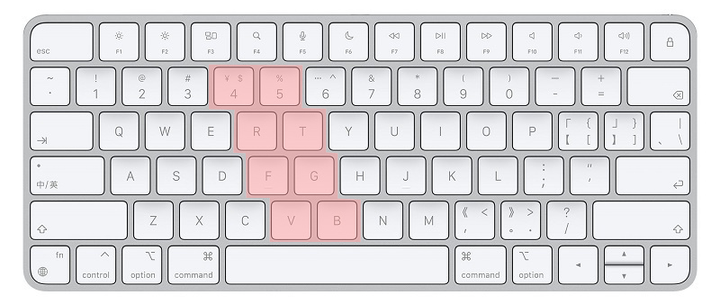
In order to click on square pink keys on keyboard in this screenshot , I will do `click(234, 89)`, `click(274, 90)`, `click(252, 129)`, `click(297, 138)`, `click(271, 172)`, `click(320, 178)`, `click(333, 214)`, `click(287, 219)`.